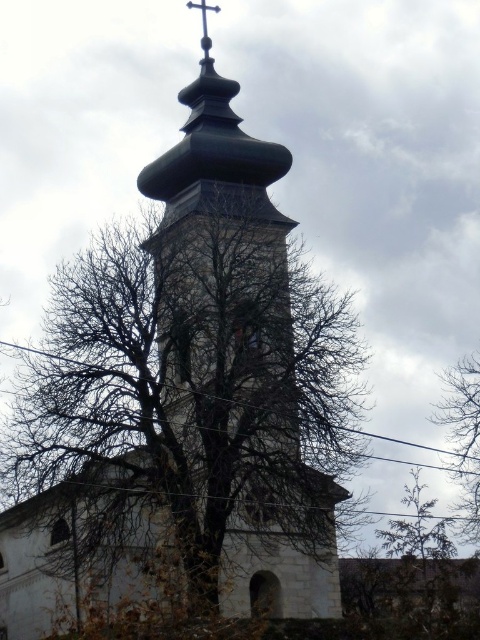
Looking at this image, you are standing in front of the church tower and want to take a photo that includes both the brown leafy tree at upper right and the green textured tree at center. Which tree should you position closer to the top of your camera frame to include both in the photo?

You should position the brown leafy tree at upper right closer to the top of your camera frame since it is already above the green textured tree at center.

You are standing in front of the church tower and want to take a photo that includes both the bare branches at center and the metallic cross at upper center. However, your camera has a limited zoom range. Based on their sizes in the image, which object should you focus on first to ensure both are in frame?

The bare branches at center is much taller than the metallic cross at upper center, so you should focus on the bare branches at center first to ensure both are in frame.

You are standing in front of the church tower and want to take a photo of the metallic cross at upper center without the bare branches at center blocking it. How should you position yourself relative to the current viewpoint?

Move to the right so that the bare branches at center are no longer blocking the view of the metallic cross at upper center.